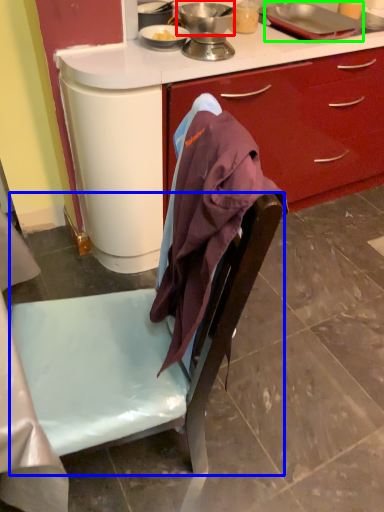
Question: Estimate the real-world distances between objects in this image. Which object is closer to kitchen appliance (highlighted by a red box), chair (highlighted by a blue box) or kitchen appliance (highlighted by a green box)?

Choices:
 (A) chair
 (B) kitchen appliance

Answer: (B)